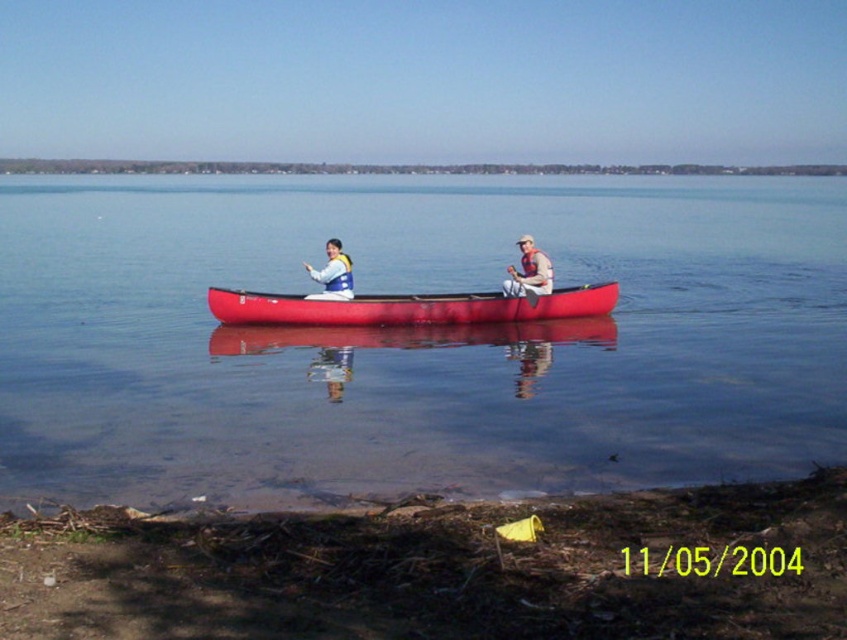
Question: Is brown dirt shore at lower left further to camera compared to white life vest at center?

Choices:
 (A) yes
 (B) no

Answer: (B)

Question: Which object appears farthest from the camera in this image?

Choices:
 (A) transparent water at center
 (B) smooth red canoe at center

Answer: (B)

Question: Is transparent water at center behind tan fabric life vest at center?

Choices:
 (A) no
 (B) yes

Answer: (A)

Question: Which point is farther to the camera?

Choices:
 (A) transparent water at center
 (B) brown dirt shore at lower left

Answer: (A)

Question: Which of the following is the farthest from the observer?

Choices:
 (A) white life vest at center
 (B) transparent water at center
 (C) wooden paddle at center
 (D) smooth red canoe at center

Answer: (C)

Question: Where is transparent water at center located in relation to smooth red canoe at center in the image?

Choices:
 (A) below
 (B) above

Answer: (B)